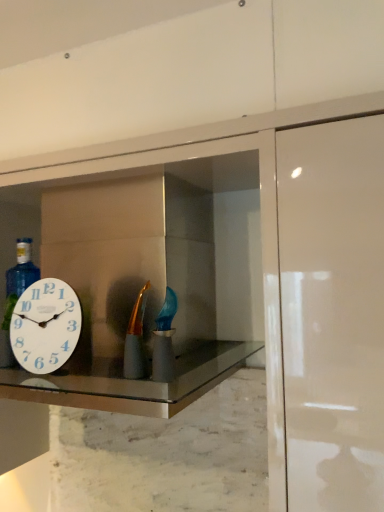
Question: Is white glossy clock at left taller or shorter than white glossy medicine cabinet at center?

Choices:
 (A) short
 (B) tall

Answer: (A)

Question: Considering the positions of point (13, 326) and point (218, 340), is point (13, 326) closer or farther from the camera than point (218, 340)?

Choices:
 (A) closer
 (B) farther

Answer: (A)

Question: Which object is the closest to the marble at center?

Choices:
 (A) white glossy clock at left
 (B) white glossy medicine cabinet at center
 (C) matte gold bottle at center

Answer: (A)

Question: Based on their relative distances, which object is nearer to the white glossy medicine cabinet at center?

Choices:
 (A) marble at center
 (B) white glossy clock at left
 (C) matte gold bottle at center

Answer: (A)